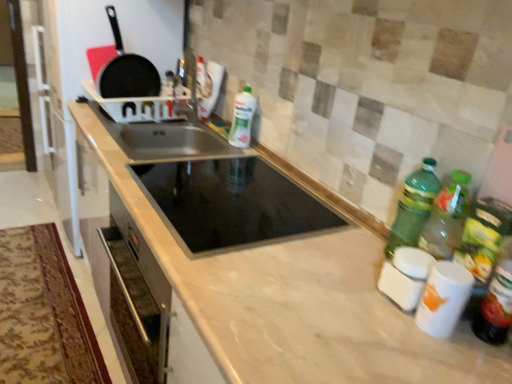
Question: Should I look upward or downward to see stainless steel sink at center, the first sink positioned from the back?

Choices:
 (A) up
 (B) down

Answer: (A)

Question: Is black glass sink at center, the 2th sink in the back-to-front sequence, looking in the opposite direction of marble countertop at center?

Choices:
 (A) no
 (B) yes

Answer: (B)

Question: Is black glass sink at center, the 2th sink in the back-to-front sequence, bigger than marble countertop at center?

Choices:
 (A) no
 (B) yes

Answer: (A)

Question: Could you tell me if black glass sink at center, the 2th sink in the back-to-front sequence, is turned towards marble countertop at center?

Choices:
 (A) yes
 (B) no

Answer: (A)

Question: Would you say black glass sink at center, the 2th sink in the back-to-front sequence, contains marble countertop at center?

Choices:
 (A) yes
 (B) no

Answer: (B)

Question: Does black glass sink at center, the 1th sink viewed from the front, touch marble countertop at center?

Choices:
 (A) yes
 (B) no

Answer: (B)

Question: Is black glass sink at center, the 2th sink in the back-to-front sequence, to the right of marble countertop at center from the viewer's perspective?

Choices:
 (A) yes
 (B) no

Answer: (A)

Question: Does black glass sink at center, the 2th sink in the back-to-front sequence, lie behind white glossy canisters at lower right?

Choices:
 (A) yes
 (B) no

Answer: (A)

Question: Is black glass sink at center, the 2th sink in the back-to-front sequence, positioned with its back to white glossy canisters at lower right?

Choices:
 (A) no
 (B) yes

Answer: (A)

Question: From a real-world perspective, is black glass sink at center, the 1th sink viewed from the front, on top of white glossy canisters at lower right?

Choices:
 (A) no
 (B) yes

Answer: (A)

Question: Could you tell me if black glass sink at center, the 2th sink in the back-to-front sequence, is turned towards white glossy canisters at lower right?

Choices:
 (A) no
 (B) yes

Answer: (A)

Question: Is black glass sink at center, the 1th sink viewed from the front, directly adjacent to white glossy canisters at lower right?

Choices:
 (A) yes
 (B) no

Answer: (B)

Question: Can you confirm if black glass sink at center, the 2th sink in the back-to-front sequence, is positioned to the left of white glossy canisters at lower right?

Choices:
 (A) yes
 (B) no

Answer: (A)

Question: Is white glossy canisters at lower right at the right side of stainless steel sink at center, which appears as the 2th sink when viewed from the front?

Choices:
 (A) yes
 (B) no

Answer: (A)